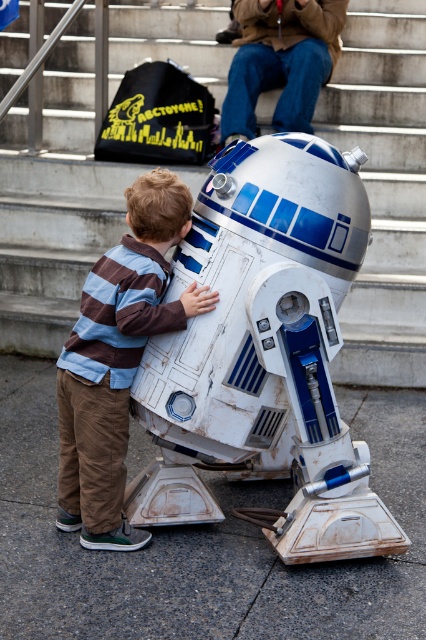
Question: Among these objects, which one is nearest to the camera?

Choices:
 (A) white matte robot at center
 (B) striped cotton shirt at center

Answer: (B)

Question: Which object is farther from the camera taking this photo?

Choices:
 (A) striped cotton shirt at center
 (B) white matte robot at center

Answer: (B)

Question: Can you confirm if white matte robot at center is positioned to the right of striped cotton shirt at center?

Choices:
 (A) yes
 (B) no

Answer: (B)

Question: Which point is closer to the camera?

Choices:
 (A) striped cotton shirt at center
 (B) white matte robot at center

Answer: (A)

Question: Does white matte robot at center appear on the right side of striped cotton shirt at center?

Choices:
 (A) yes
 (B) no

Answer: (B)

Question: Can you confirm if white matte robot at center is positioned above striped cotton shirt at center?

Choices:
 (A) yes
 (B) no

Answer: (A)